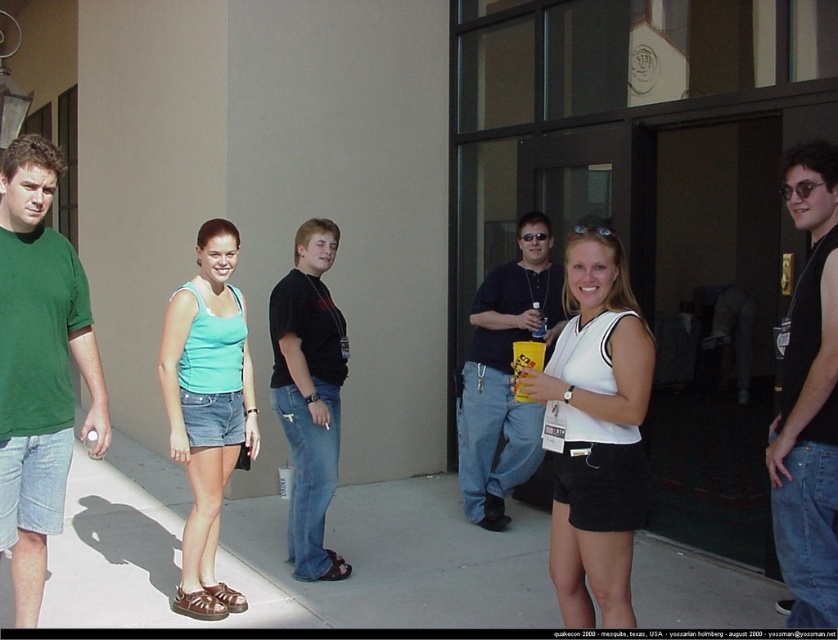
You are standing on the smooth concrete pavement at center and looking up. There is a black cotton shirt at center above you. What is directly above you?

The black cotton shirt at center is directly above you as it is positioned over the smooth concrete pavement at center.

Looking at this image, you are a photographer trying to capture a group photo of the two people wearing the white matte tank top at center and the matte black shirt at center. The camera you are using has a minimum focusing distance of 1.5 meters. Can you take a clear photo of both individuals simultaneously without moving the camera?

The white matte tank top at center and the matte black shirt at center are 1.59 meters apart. Since the camera has a minimum focusing distance of 1.5 meters, the photographer can take a clear photo of both individuals simultaneously without moving the camera because the distance between them is within the camera range.